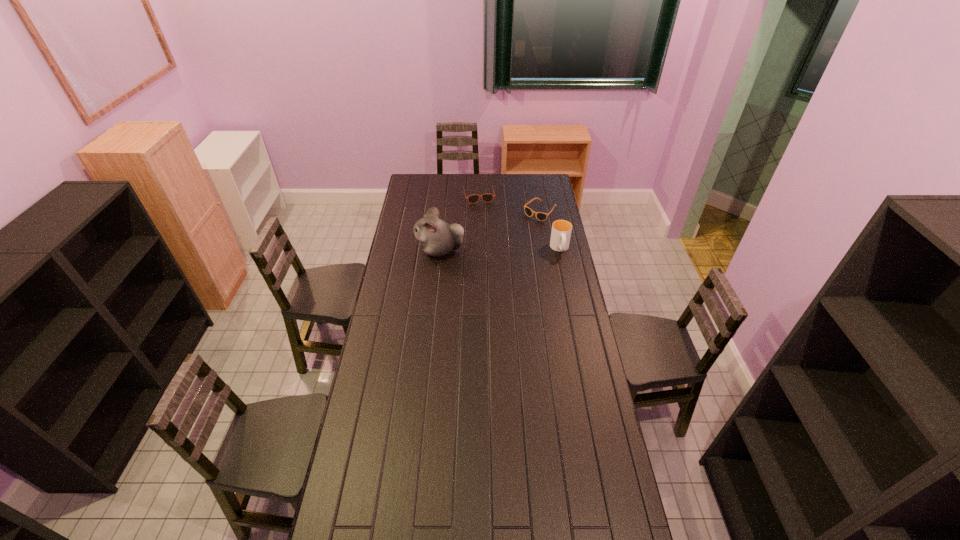
Locate an element on the screen. Image resolution: width=960 pixels, height=540 pixels. blank area at the right edge is located at coordinates (540, 272).

Locate an element on the screen. This screenshot has width=960, height=540. free space between the cup and the right sunglasses is located at coordinates (550, 230).

Where is `empty location between the second tallest object and the right sunglasses`? The image size is (960, 540). empty location between the second tallest object and the right sunglasses is located at coordinates (550, 230).

At what (x,y) coordinates should I click in order to perform the action: click on free space between the second tallest object and the left sunglasses. Please return your answer as a coordinate pair (x, y). This screenshot has height=540, width=960. Looking at the image, I should click on tap(519, 222).

In order to click on unoccupied position between the tallest object and the cup in this screenshot , I will do `click(500, 249)`.

What are the coordinates of `free space between the left sunglasses and the hamster` in the screenshot? It's located at (459, 222).

Identify the location of unoccupied position between the left sunglasses and the right sunglasses. The image size is (960, 540). (510, 204).

Locate an element on the screen. vacant point located between the tallest object and the right sunglasses is located at coordinates (490, 231).

At what (x,y) coordinates should I click in order to perform the action: click on free point between the hamster and the right sunglasses. Please return your answer as a coordinate pair (x, y). This screenshot has width=960, height=540. Looking at the image, I should click on (490, 231).

Locate an element on the screen. This screenshot has height=540, width=960. vacant point located between the left sunglasses and the cup is located at coordinates (519, 222).